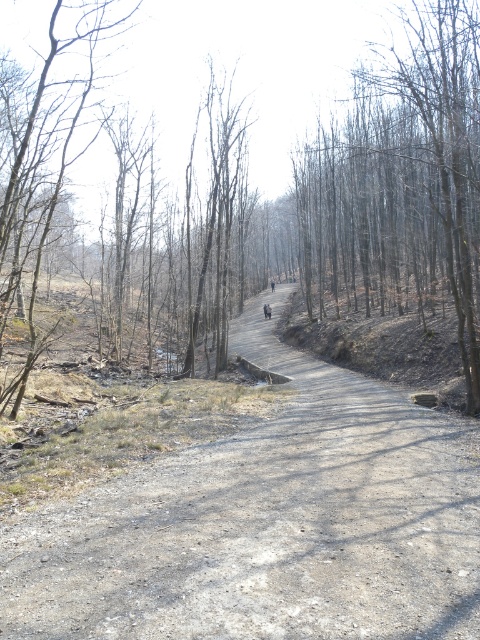
Question: Among these points, which one is nearest to the camera?

Choices:
 (A) (245, 154)
 (B) (215, 292)
 (C) (457, 493)

Answer: (C)

Question: Is brown bark tree at upper center to the right of brown bark tree at left from the viewer's perspective?

Choices:
 (A) yes
 (B) no

Answer: (A)

Question: Based on their relative distances, which object is farther from the brown bark tree at left?

Choices:
 (A) dull gray gravel path at center
 (B) dark gray jacket at center

Answer: (B)

Question: Can you confirm if brown bark tree at upper center is smaller than brown bark tree at center?

Choices:
 (A) yes
 (B) no

Answer: (B)

Question: Which object appears farthest from the camera in this image?

Choices:
 (A) dull gray gravel path at center
 (B) brown dirt path at center
 (C) dark gray jacket at center

Answer: (C)

Question: In this image, where is brown bark tree at upper center located relative to brown bark tree at left?

Choices:
 (A) left
 (B) right

Answer: (B)